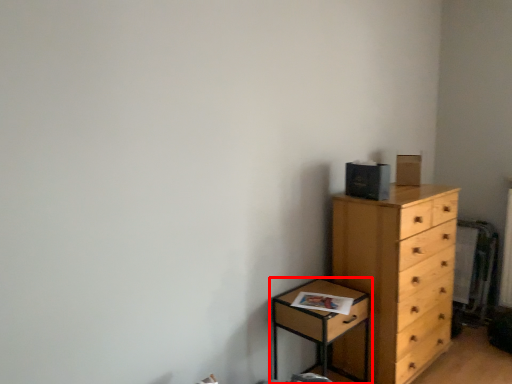
Question: From the image's perspective, where is nightstand (annotated by the red box) located relative to chest of drawers?

Choices:
 (A) above
 (B) below

Answer: (B)